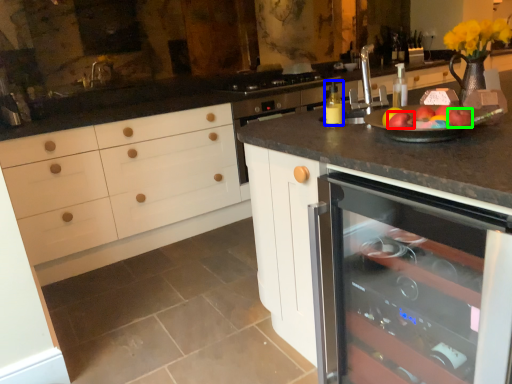
Question: Considering the real-world distances, which object is closest to apple (highlighted by a red box)? bottle (highlighted by a blue box) or apple (highlighted by a green box).

Choices:
 (A) bottle
 (B) apple

Answer: (B)